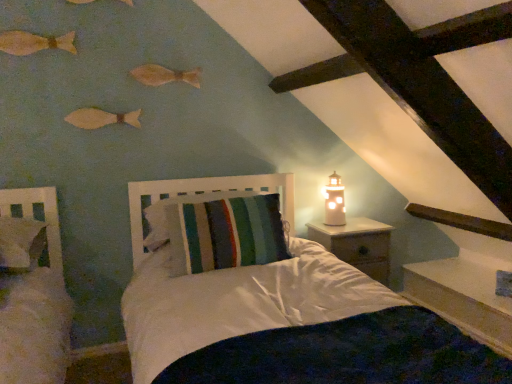
Identify the location of free location in front of metallic gold lighthouse at right. Image resolution: width=512 pixels, height=384 pixels. (342, 232).